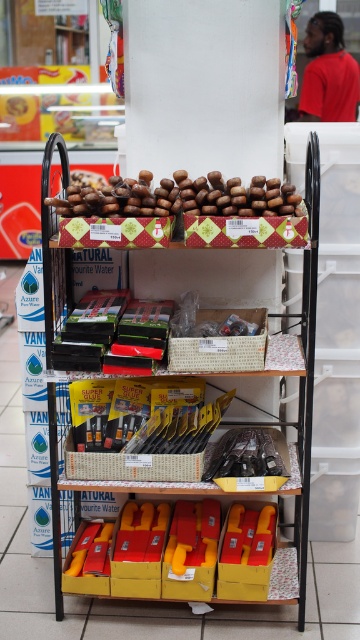
Question: Is wooden handles at upper center wider than wooden beads at center?

Choices:
 (A) no
 (B) yes

Answer: (B)

Question: Among these objects, which one is nearest to the camera?

Choices:
 (A) wooden handles at upper center
 (B) wooden beads at center

Answer: (A)

Question: Is wooden handles at upper center to the right of wooden beads at center from the viewer's perspective?

Choices:
 (A) yes
 (B) no

Answer: (A)

Question: Does wooden handles at upper center appear over wooden beads at center?

Choices:
 (A) no
 (B) yes

Answer: (A)

Question: Which object is closer to the camera taking this photo?

Choices:
 (A) wooden beads at center
 (B) wooden handles at upper center

Answer: (B)